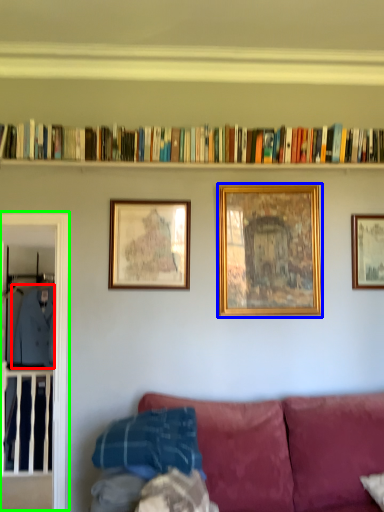
Question: Which is farther away from clothing (highlighted by a red box)? picture frame (highlighted by a blue box) or glass door (highlighted by a green box)?

Choices:
 (A) picture frame
 (B) glass door

Answer: (A)